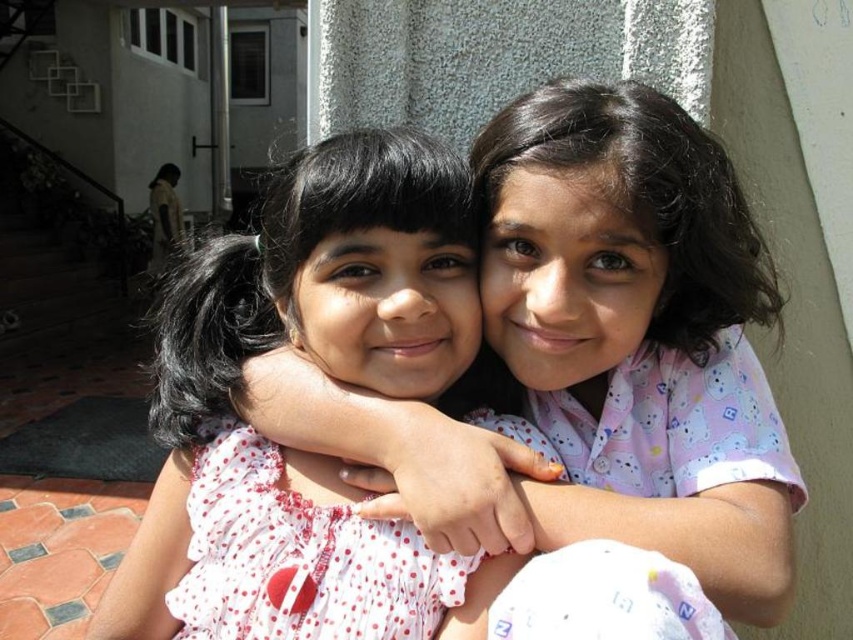
Question: Where is white dotted dress at center located in relation to white polka dot fabric dress at center in the image?

Choices:
 (A) left
 (B) right

Answer: (A)

Question: Which of the following is the closest to the observer?

Choices:
 (A) white polka dot fabric dress at center
 (B) white dotted dress at center

Answer: (B)

Question: Can you confirm if white dotted dress at center is smaller than white polka dot fabric dress at center?

Choices:
 (A) yes
 (B) no

Answer: (B)

Question: Is white dotted dress at center in front of white polka dot fabric dress at center?

Choices:
 (A) no
 (B) yes

Answer: (B)

Question: Among these points, which one is nearest to the camera?

Choices:
 (A) (260, 480)
 (B) (231, 483)

Answer: (A)

Question: Among these points, which one is farthest from the camera?

Choices:
 (A) click(299, 557)
 (B) click(434, 301)

Answer: (B)